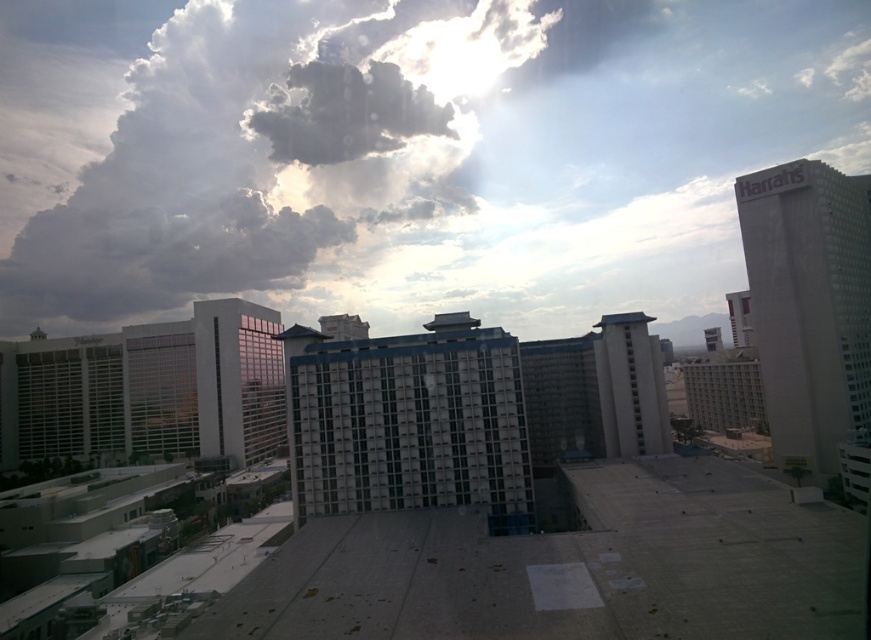
Question: Which object appears farthest from the camera in this image?

Choices:
 (A) white glass building at right
 (B) white fluffy cloud at upper center

Answer: (B)

Question: Is white glass building at left smaller than white textured building at center?

Choices:
 (A) yes
 (B) no

Answer: (B)

Question: Which is farther from the white fluffy cloud at upper center?

Choices:
 (A) white glass building at right
 (B) white glass building at left
 (C) gray concrete building at center

Answer: (A)

Question: Observing the image, what is the correct spatial positioning of white fluffy cloud at upper center in reference to white glass building at left?

Choices:
 (A) left
 (B) right

Answer: (B)

Question: Is the position of white fluffy cloud at upper center less distant than that of white glass building at right?

Choices:
 (A) yes
 (B) no

Answer: (B)

Question: Among these points, which one is farthest from the camera?

Choices:
 (A) (815, 451)
 (B) (190, 348)
 (C) (433, 212)
 (D) (323, 513)

Answer: (C)